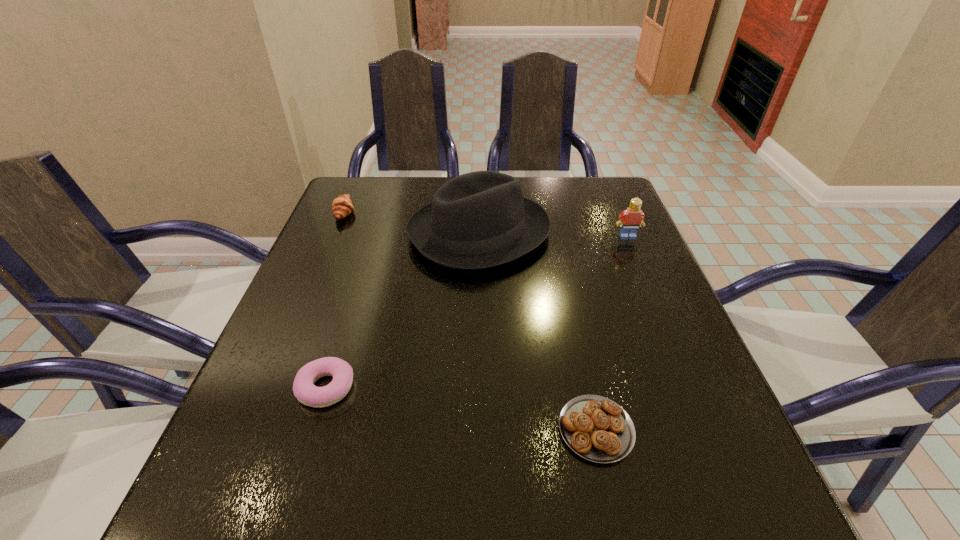
The height and width of the screenshot is (540, 960). Find the location of `free point between the fourth shortest object and the rightmost pastry`. free point between the fourth shortest object and the rightmost pastry is located at coordinates (612, 333).

Identify the location of free space that is in between the Lego and the second pastry from right to left. This screenshot has width=960, height=540. (477, 312).

You are a GUI agent. You are given a task and a screenshot of the screen. Output one action in this format:
    pyautogui.click(x=<x>, y=<y>)
    Task: Click on the free space between the rightmost pastry and the fourth object from right to left
    Image resolution: width=960 pixels, height=540 pixels.
    Given the screenshot: What is the action you would take?
    pyautogui.click(x=461, y=408)

The height and width of the screenshot is (540, 960). Identify the location of object that is the fourth closest to the tallest object. (596, 428).

Find the location of a particular element. This screenshot has width=960, height=540. object that stands as the fourth closest to the second pastry from right to left is located at coordinates (630, 219).

Locate an element on the screen. Image resolution: width=960 pixels, height=540 pixels. pastry that is the second nearest to the leftmost object is located at coordinates (596, 428).

Where is `pastry that is the closest to the rightmost pastry`? pastry that is the closest to the rightmost pastry is located at coordinates (304, 390).

The width and height of the screenshot is (960, 540). I want to click on free spot that satisfies the following two spatial constraints: 1. on the front-facing side of the leftmost pastry; 2. on the back side of the fourth object from right to left, so click(x=270, y=388).

At what (x,y) coordinates should I click in order to perform the action: click on vacant position in the image that satisfies the following two spatial constraints: 1. on the front-facing side of the third tallest object; 2. on the back side of the rightmost pastry. Please return your answer as a coordinate pair (x, y). Looking at the image, I should click on (252, 429).

The height and width of the screenshot is (540, 960). In order to click on free space that satisfies the following two spatial constraints: 1. on the front-facing side of the third tallest object; 2. on the back side of the fedora in this screenshot , I will do `click(336, 233)`.